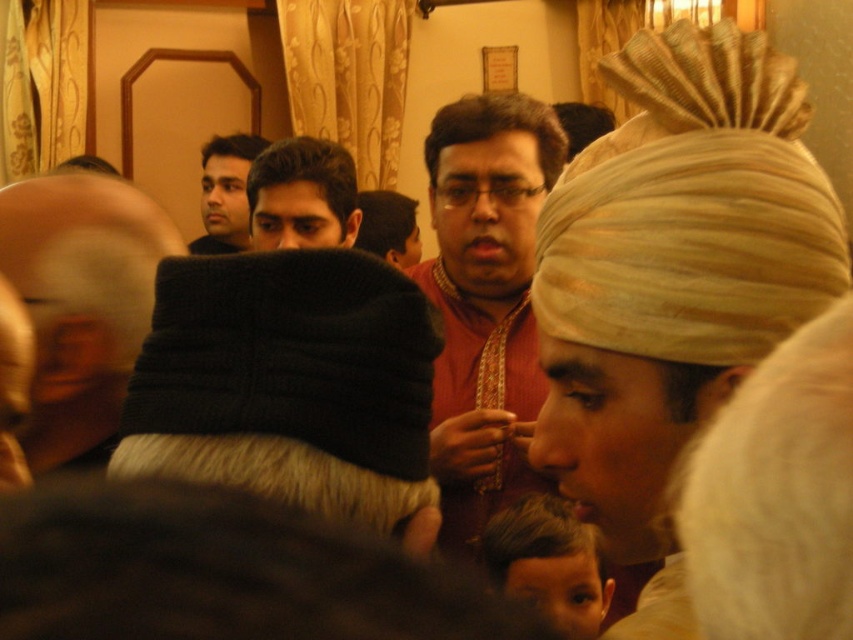
You are organizing a photo shoot and need to ensure that the matte red shirt at center and the matte gold turban at center are visible in the frame. Based on their sizes, which object should you prioritize positioning closer to the camera to maintain clarity?

The matte red shirt at center has a smaller size compared to the matte gold turban at center. To maintain clarity, prioritize positioning the matte red shirt at center closer to the camera since smaller objects may require closer framing for visibility.

You are standing in the room and want to greet the person wearing the matte red shirt at center. Which direction should you move to reach them from the black knitted hat at left?

Since the black knitted hat at left is to the left of matte red shirt at center, you should move to the right to reach the matte red shirt at center from the black knitted hat at left.

In the scene described, there are two individuals with distinctive headwear. The first wears a black knitted cap at left, and the second has a matte gold turban at center. From the perspective of someone standing in the room, which headwear is positioned closer to the right side?

The matte gold turban at center is positioned closer to the right side because the black knitted cap at left is to its left, meaning the matte gold turban at center is further right.